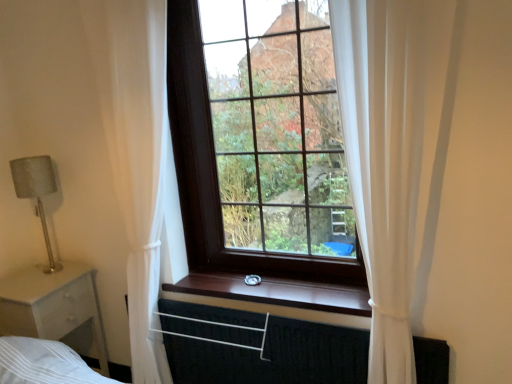
Question: Considering the positions of white matte nightstand at left and black fabric canopy bed at lower center in the image, is white matte nightstand at left taller or shorter than black fabric canopy bed at lower center?

Choices:
 (A) tall
 (B) short

Answer: (A)

Question: Does point (10, 281) appear closer or farther from the camera than point (239, 312)?

Choices:
 (A) closer
 (B) farther

Answer: (B)

Question: Which of these objects is positioned farthest from the white sheer curtain at left, acting as the second curtain starting from the right?

Choices:
 (A) wooden at center
 (B) white sheer curtain at right, which appears as the 1th curtain when viewed from the right
 (C) satin silver lamp at left
 (D) dark wood window at center
 (E) black fabric canopy bed at lower center

Answer: (B)

Question: Which object is positioned farthest from the white sheer curtain at right, which appears as the 1th curtain when viewed from the right?

Choices:
 (A) satin silver lamp at left
 (B) white sheer curtain at left, acting as the second curtain starting from the right
 (C) dark wood window at center
 (D) wooden at center
 (E) white matte nightstand at left

Answer: (A)